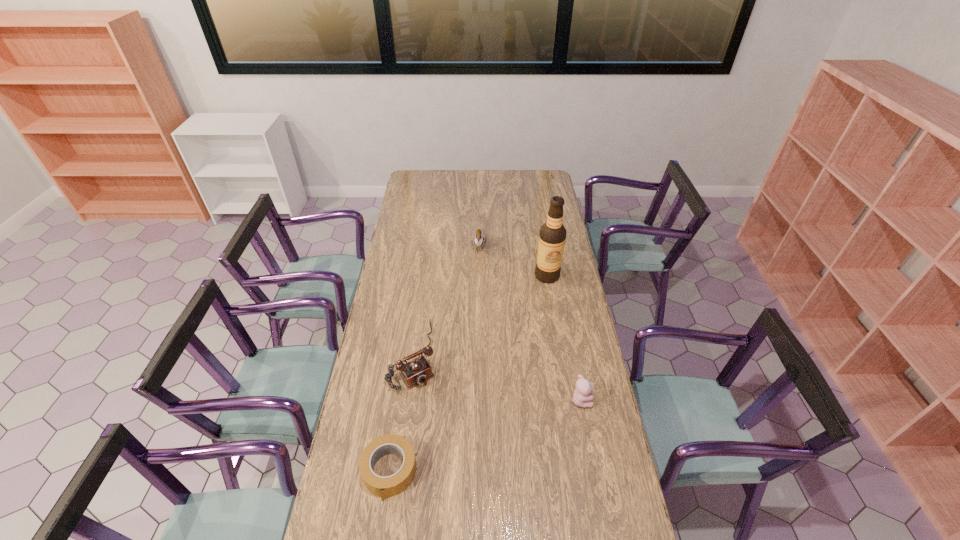
Locate an element on the screen. This screenshot has height=540, width=960. free space on the desktop that is between the shortest object and the teddy bear and is positioned on the label of the second farthest object is located at coordinates (500, 430).

You are a GUI agent. You are given a task and a screenshot of the screen. Output one action in this format:
    pyautogui.click(x=<x>, y=<y>)
    Task: Click on the free space on the desktop that is between the duct tape and the teddy bear and is positioned on the dial of the telephone
    The image size is (960, 540).
    Given the screenshot: What is the action you would take?
    point(469,441)

Locate an element on the screen. free space on the desktop that is between the duct tape and the teddy bear and is positioned at the face of the third object from right to left is located at coordinates (467, 442).